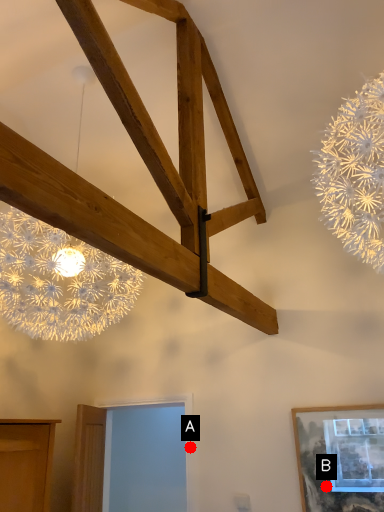
Question: Two points are circled on the image, labeled by A and B beside each circle. Which point is farther from the camera taking this photo?

Choices:
 (A) A is further
 (B) B is further

Answer: (A)